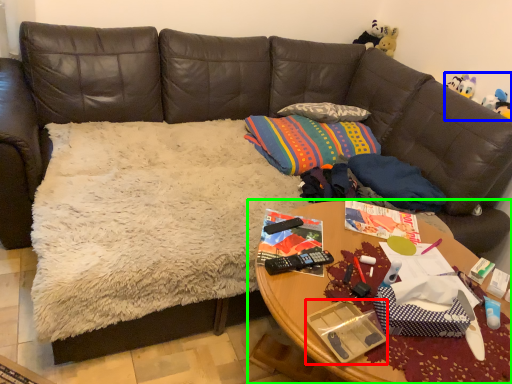
Question: Which is nearer to the package (highlighted by a red box)? toy (highlighted by a blue box) or table (highlighted by a green box).

Choices:
 (A) toy
 (B) table

Answer: (B)